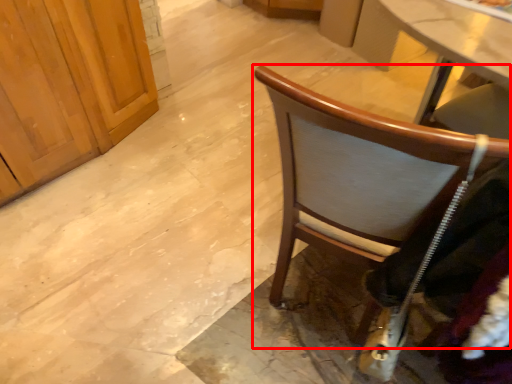
Question: From the image's perspective, where is chair (annotated by the red box) located in relation to clothing in the image?

Choices:
 (A) above
 (B) below

Answer: (A)